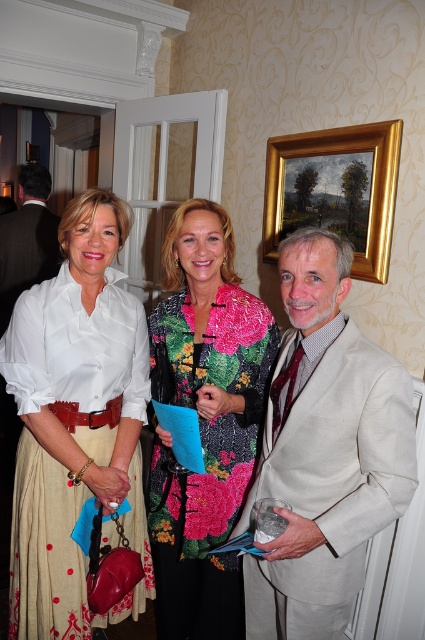
Does point (84, 429) come behind point (215, 410)?

That is True.

Between point (136, 481) and point (224, 525), which one is positioned behind?

Point (136, 481)

The height and width of the screenshot is (640, 425). Describe the element at coordinates (76, 420) in the screenshot. I see `matte white blouse at center` at that location.

Where is `matte white blouse at center`? The width and height of the screenshot is (425, 640). matte white blouse at center is located at coordinates (76, 420).

Does floral sequined jacket at center have a greater width compared to goldmaterial/texturepicture frame at upper center?

Indeed, floral sequined jacket at center has a greater width compared to goldmaterial/texturepicture frame at upper center.

Locate an element on the screen. The width and height of the screenshot is (425, 640). floral sequined jacket at center is located at coordinates (204, 420).

Find the location of a particular element. The height and width of the screenshot is (640, 425). floral sequined jacket at center is located at coordinates (204, 420).

From the picture: Does floral sequined jacket at center appear on the right side of matte black suit at center?

Yes, floral sequined jacket at center is to the right of matte black suit at center.

Which of these two, floral sequined jacket at center or matte black suit at center, stands shorter?

Standing shorter between the two is matte black suit at center.

What do you see at coordinates (204, 420) in the screenshot?
I see `floral sequined jacket at center` at bounding box center [204, 420].

What are the coordinates of `floral sequined jacket at center` in the screenshot? It's located at (204, 420).